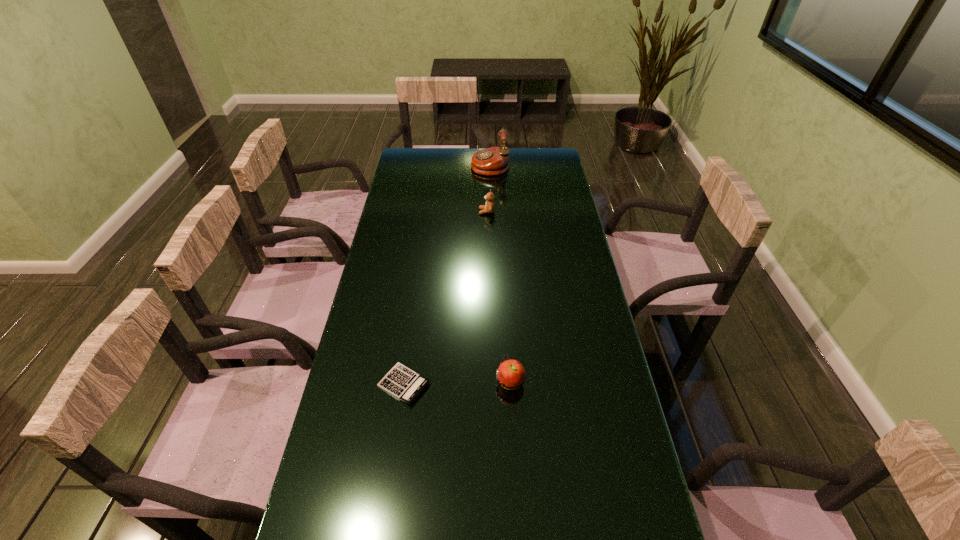
You are a GUI agent. You are given a task and a screenshot of the screen. Output one action in this format:
    pyautogui.click(x=<x>, y=<y>)
    Task: Click on the vacant area that lies between the apple and the teddy bear
    The width and height of the screenshot is (960, 540).
    Given the screenshot: What is the action you would take?
    pyautogui.click(x=498, y=296)

Point out which object is positioned as the third nearest to the calculator. Please provide its 2D coordinates. Your answer should be formatted as a tuple, i.e. [(x, y)], where the tuple contains the x and y coordinates of a point satisfying the conditions above.

[(492, 161)]

This screenshot has width=960, height=540. I want to click on object that is the closest one to the farthest object, so click(x=489, y=207).

Where is `vacant space that satisfies the following two spatial constraints: 1. on the front-facing side of the apple; 2. on the left side of the second farthest object`? vacant space that satisfies the following two spatial constraints: 1. on the front-facing side of the apple; 2. on the left side of the second farthest object is located at coordinates (490, 381).

The width and height of the screenshot is (960, 540). Identify the location of free spot that satisfies the following two spatial constraints: 1. on the dial of the telephone; 2. on the left side of the apple. (497, 381).

You are a GUI agent. You are given a task and a screenshot of the screen. Output one action in this format:
    pyautogui.click(x=<x>, y=<y>)
    Task: Click on the free location that satisfies the following two spatial constraints: 1. on the dial of the apple; 2. on the right side of the farthest object
    
    Given the screenshot: What is the action you would take?
    pyautogui.click(x=497, y=381)

The image size is (960, 540). In order to click on vacant area that satisfies the following two spatial constraints: 1. on the back side of the apple; 2. on the dial of the tallest object in this screenshot , I will do `click(498, 164)`.

At what (x,y) coordinates should I click in order to perform the action: click on vacant point that satisfies the following two spatial constraints: 1. on the front-facing side of the third nearest object; 2. on the left side of the apple. Please return your answer as a coordinate pair (x, y). Looking at the image, I should click on (490, 381).

Find the location of `free space that satisfies the following two spatial constraints: 1. on the dial of the tallest object; 2. on the right side of the apple`. free space that satisfies the following two spatial constraints: 1. on the dial of the tallest object; 2. on the right side of the apple is located at coordinates (497, 381).

You are a GUI agent. You are given a task and a screenshot of the screen. Output one action in this format:
    pyautogui.click(x=<x>, y=<y>)
    Task: Click on the vacant point that satisfies the following two spatial constraints: 1. on the front-facing side of the second farthest object; 2. on the back side of the apple
    
    Given the screenshot: What is the action you would take?
    pyautogui.click(x=490, y=381)